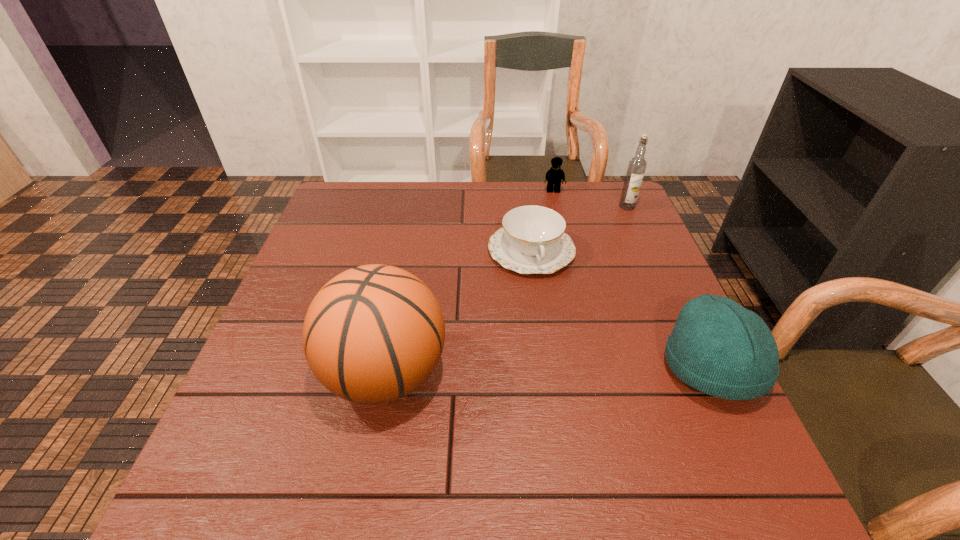
Identify the location of the leftmost object. This screenshot has width=960, height=540. (373, 334).

You are a GUI agent. You are given a task and a screenshot of the screen. Output one action in this format:
    pyautogui.click(x=<x>, y=<y>)
    Task: Click on the beanie
    This screenshot has width=960, height=540.
    Given the screenshot: What is the action you would take?
    pyautogui.click(x=718, y=347)

At what (x,y) coordinates should I click in order to perform the action: click on the third nearest object. Please return your answer as a coordinate pair (x, y). The width and height of the screenshot is (960, 540). Looking at the image, I should click on (532, 240).

You are a GUI agent. You are given a task and a screenshot of the screen. Output one action in this format:
    pyautogui.click(x=<x>, y=<y>)
    Task: Click on the chinaware
    The height and width of the screenshot is (540, 960).
    Given the screenshot: What is the action you would take?
    pyautogui.click(x=532, y=240)

The width and height of the screenshot is (960, 540). Find the location of `the fourth tallest object`. the fourth tallest object is located at coordinates (554, 176).

The image size is (960, 540). What are the coordinates of `the farthest object` in the screenshot? It's located at (554, 176).

Find the location of a particular element. The height and width of the screenshot is (540, 960). the second farthest object is located at coordinates (636, 168).

This screenshot has width=960, height=540. Find the location of `vacant space situated 0.390m on the right of the basketball`. vacant space situated 0.390m on the right of the basketball is located at coordinates pyautogui.click(x=645, y=373).

The height and width of the screenshot is (540, 960). In order to click on vacant space located on the back of the beanie in this screenshot , I will do `click(669, 280)`.

The image size is (960, 540). Find the location of `vacant region located on the handle side of the shortest object`. vacant region located on the handle side of the shortest object is located at coordinates (590, 425).